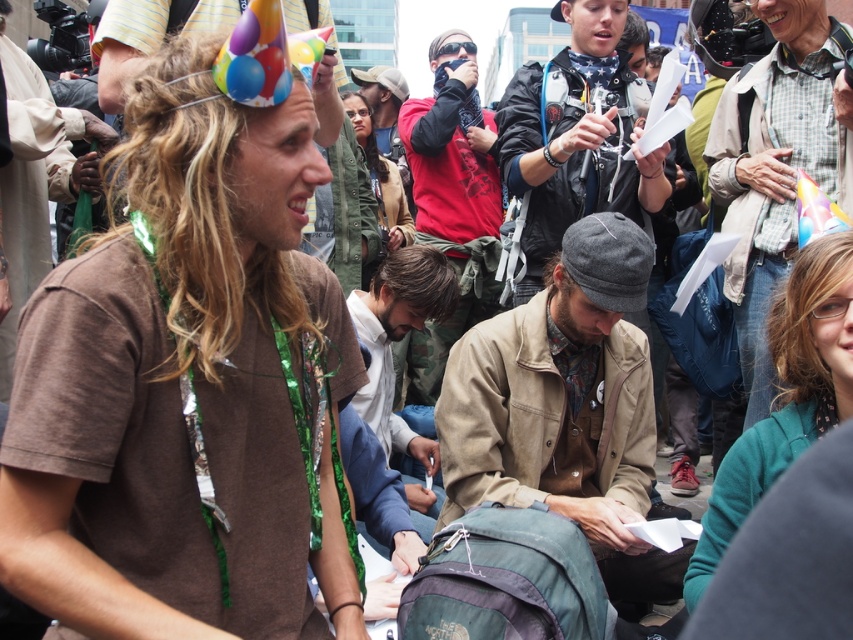
Looking at this image, is red cotton shirt at center bigger than blue denim jacket at center?

Yes.

Which is above, red cotton shirt at center or blue denim jacket at center?

red cotton shirt at center is above.

Between point (461, 44) and point (370, 317), which one is positioned behind?

The point (461, 44) is behind.

Identify the location of red cotton shirt at center. (450, 204).

Is point (451, 436) more distant than point (577, 128)?

No, (451, 436) is closer to viewer.

Image resolution: width=853 pixels, height=640 pixels. Describe the element at coordinates (566, 408) in the screenshot. I see `flannel shirt at center` at that location.

Image resolution: width=853 pixels, height=640 pixels. Identify the location of flannel shirt at center. click(566, 408).

Between plaid flannel shirt at upper right and leather jacket at center, which one is positioned lower?

plaid flannel shirt at upper right

Identify the location of plaid flannel shirt at upper right. The image size is (853, 640). (776, 164).

Find the location of a particular element. The image size is (853, 640). plaid flannel shirt at upper right is located at coordinates (776, 164).